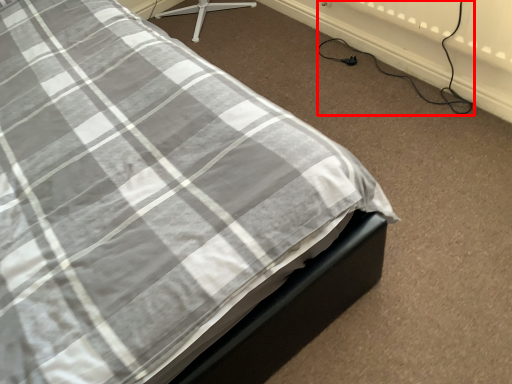
Question: From the image's perspective, where is cable (annotated by the red box) located in relation to plug in the image?

Choices:
 (A) above
 (B) below

Answer: (A)